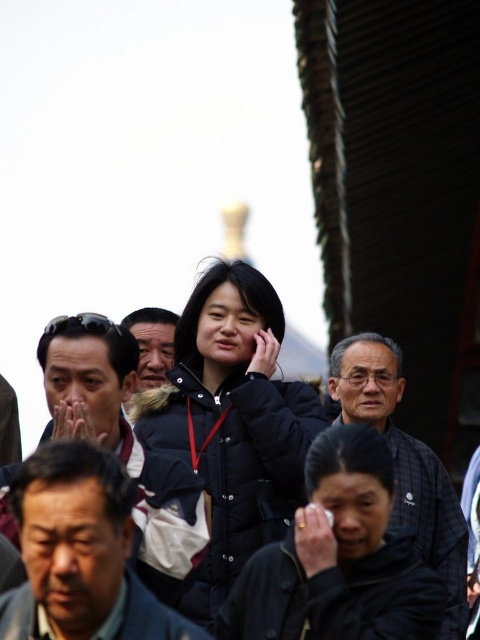
Question: From the image, what is the correct spatial relationship of plaid fabric shirt at center in relation to dark gray jacket at center?

Choices:
 (A) above
 (B) below

Answer: (B)

Question: Is plaid fabric shirt at center thinner than dark gray jacket at center?

Choices:
 (A) no
 (B) yes

Answer: (A)

Question: Which point is farther to the camera?

Choices:
 (A) (105, 429)
 (B) (399, 464)
 (C) (154, 368)

Answer: (C)

Question: Among these objects, which one is nearest to the camera?

Choices:
 (A) plaid fabric shirt at center
 (B) dark gray jacket at center
 (C) matte black jacket at center

Answer: (C)

Question: Can you confirm if matte black jacket at center is positioned to the left of plaid fabric shirt at center?

Choices:
 (A) no
 (B) yes

Answer: (B)

Question: Which of the following is the closest to the observer?

Choices:
 (A) (170, 330)
 (B) (103, 323)
 (C) (382, 348)

Answer: (B)